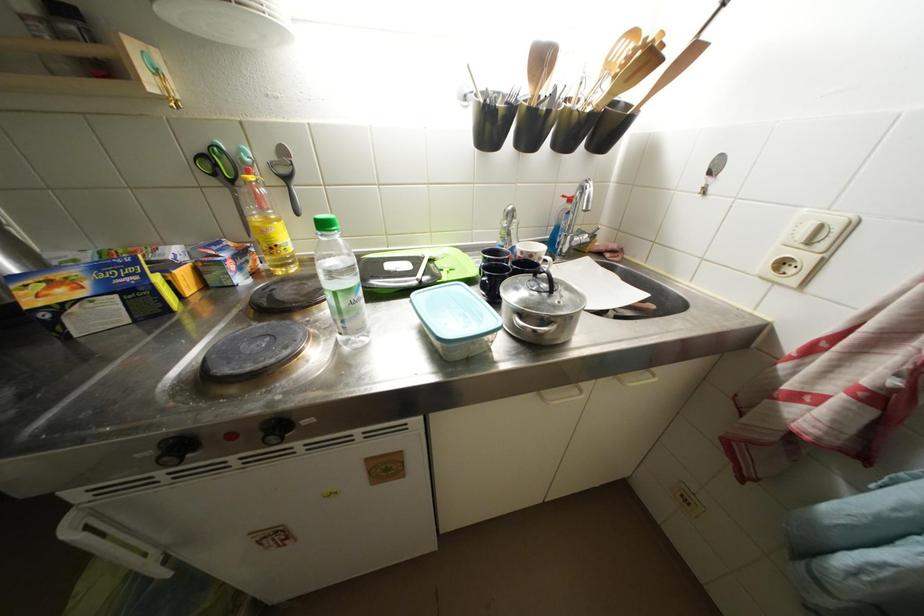
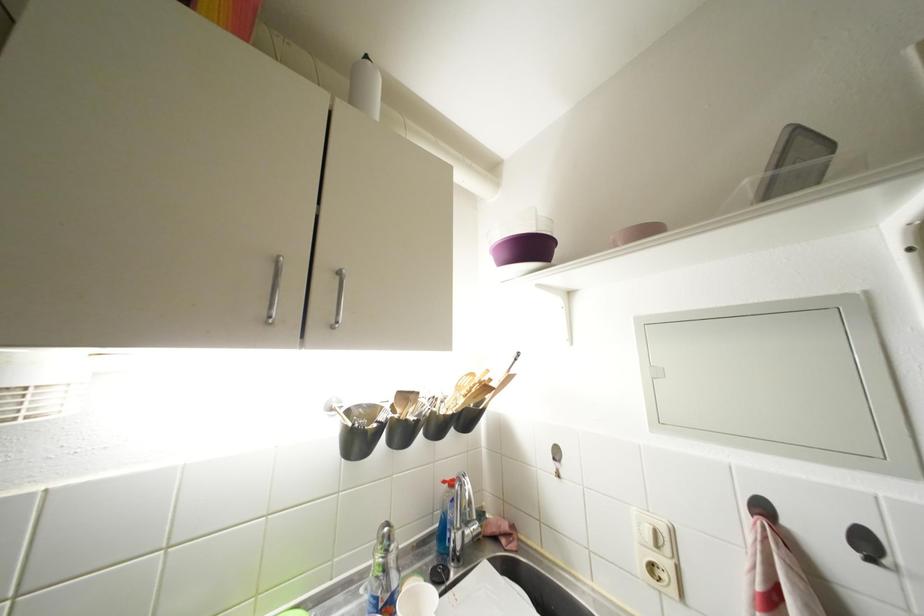
The point at [816,246] is marked in the first image. Where is the corresponding point in the second image?

(663, 549)